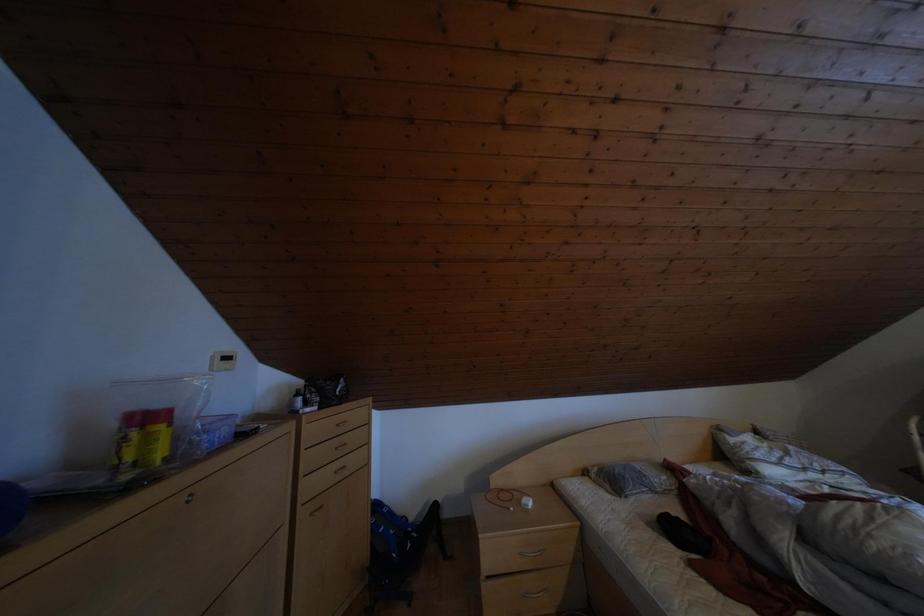
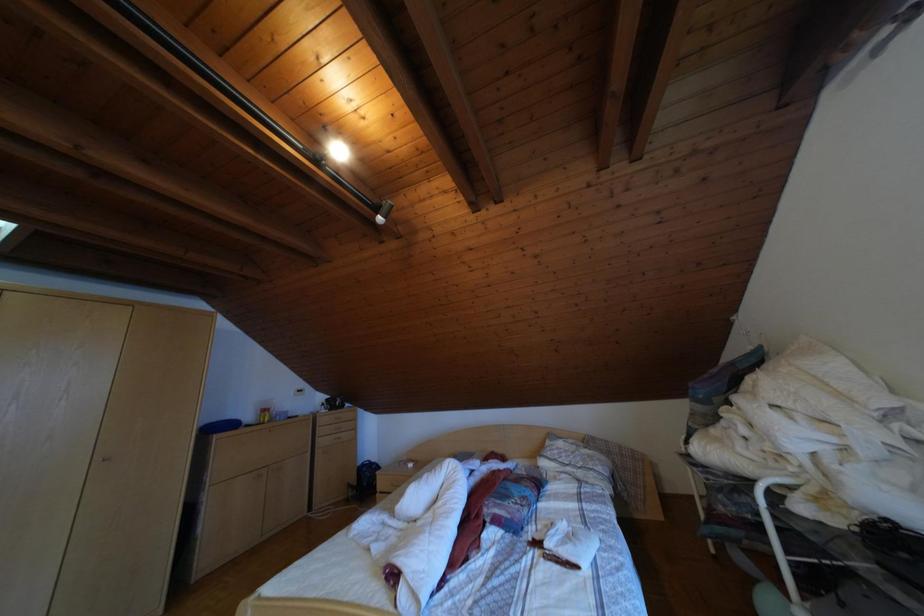
Question: What movement of the cameraman would produce the second image?

Choices:
 (A) Left
 (B) Right
 (C) Forward
 (D) Backward

Answer: (B)